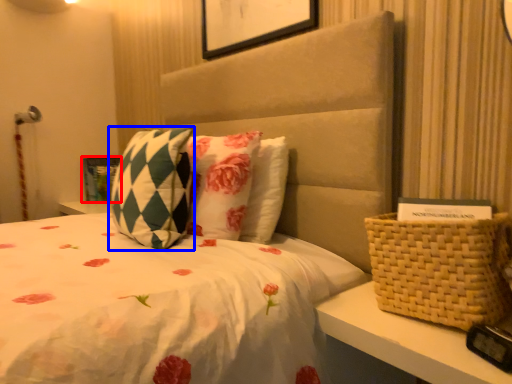
Question: Among these objects, which one is nearest to the camera, picture frame (highlighted by a red box) or pillow (highlighted by a blue box)?

Choices:
 (A) picture frame
 (B) pillow

Answer: (B)